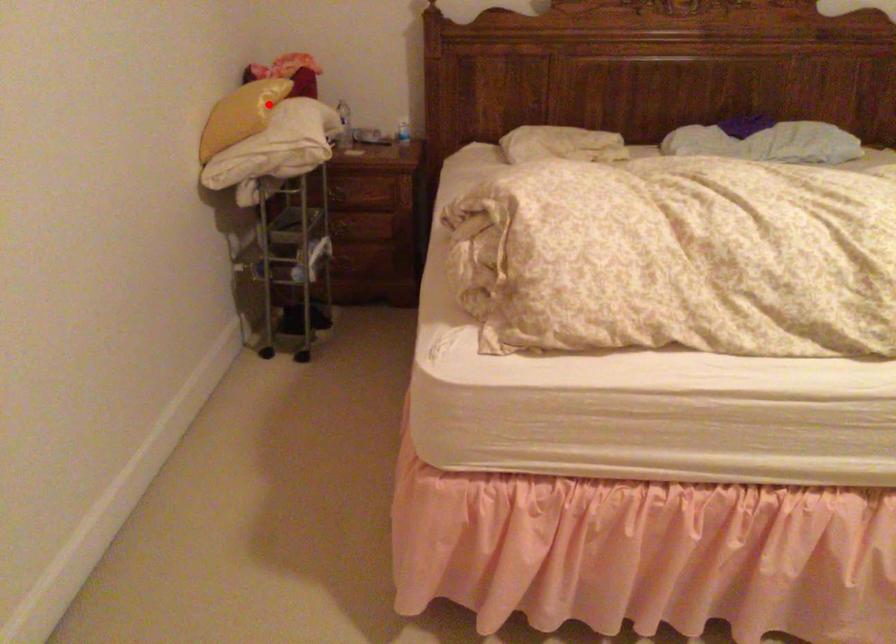
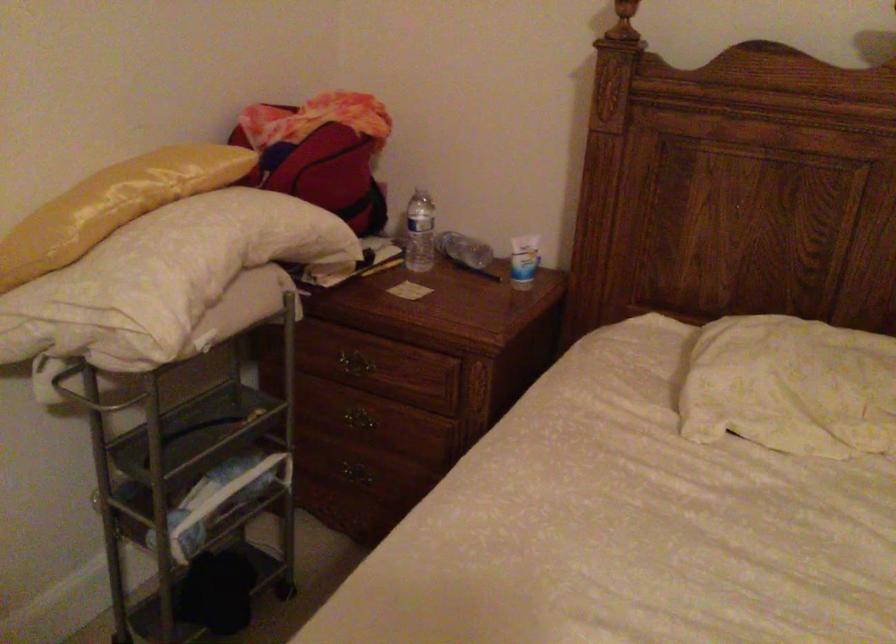
In the second image, find the point that corresponds to the highlighted location in the first image.

(113, 205)